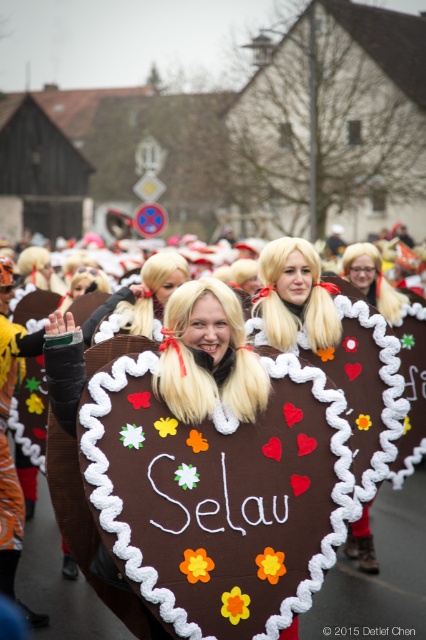
Question: Which point is closer to the camera?

Choices:
 (A) (39, 608)
 (B) (316, 364)

Answer: (B)

Question: Can you confirm if brown cardboard heart at center is positioned above blonde wig at center?

Choices:
 (A) yes
 (B) no

Answer: (A)

Question: Is brown cardboard heart at center closer to camera compared to blonde wig at center?

Choices:
 (A) yes
 (B) no

Answer: (A)

Question: Can you confirm if brown cardboard heart at center is positioned below blonde wig at center?

Choices:
 (A) no
 (B) yes

Answer: (A)

Question: Which object is closer to the camera taking this photo?

Choices:
 (A) blonde wig at center
 (B) brown cardboard heart at center

Answer: (B)